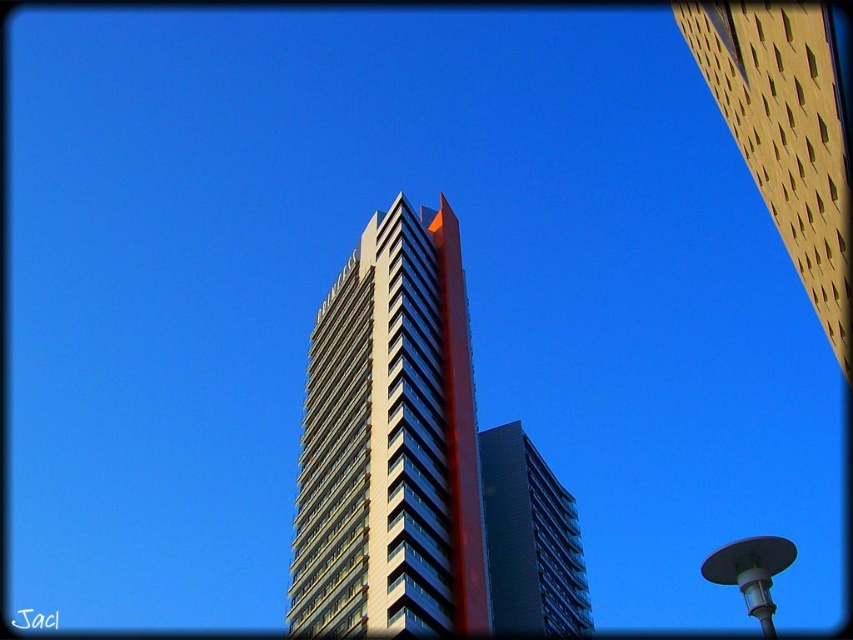
Looking at this image, you are standing at the base of the tall modern building and want to take a photo of the gold textured building at upper right. Based on its position, where would you aim your camera to capture it in the frame?

The gold textured building at upper right is located at coordinates point (785, 134), so you should aim your camera towards the upper right corner of the frame to capture it.